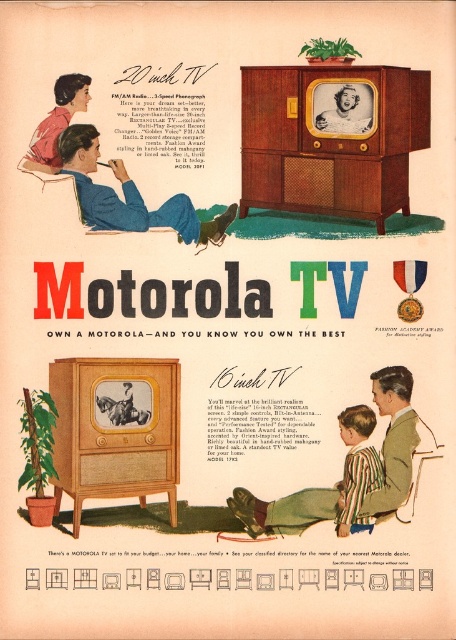
In the vintage Motorola TV advertisement, there are two clothing items depicted. The striped fabric shirt at lower center and the matte pink blouse at upper left. Which clothing item takes up more space in the image?

The striped fabric shirt at lower center has a larger size compared to the matte pink blouse at upper left, so it takes up more space in the image.

In the Motorola TV advertisement, there are two points marked in the image. The first point is at coordinate [134,218] and the second point is at [337,536]. From the perspective of someone looking at the ad, which point is closer to the viewer?

Point [337,536] is closer to the viewer because point [134,218] is behind it.

In the vintage Motorola TV advertisement, there is a blue fabric jacket at upper left and a striped fabric shirt at lower right. Which one is closer to the viewer?

The blue fabric jacket at upper left is closer to the viewer because the striped fabric shirt at lower right is behind it.